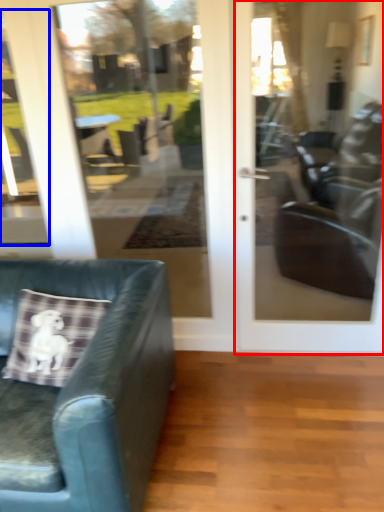
Question: Which object appears farthest to the camera in this image, door (highlighted by a red box) or window (highlighted by a blue box)?

Choices:
 (A) door
 (B) window

Answer: (B)